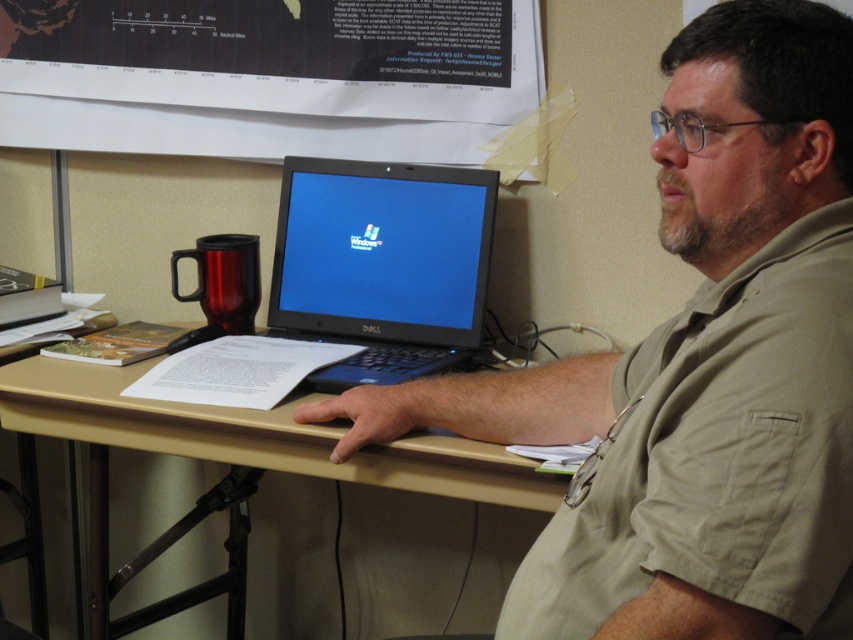
Question: Among these points, which one is farthest from the camera?

Choices:
 (A) (335, 163)
 (B) (225, 452)
 (C) (134, 132)

Answer: (C)

Question: Which object is positioned closest to the white paper at upper center?

Choices:
 (A) beige wood computer desk at center
 (B) black plastic laptop at center
 (C) matte black laptop at center

Answer: (B)

Question: Can you confirm if black plastic laptop at center is thinner than beige wood computer desk at center?

Choices:
 (A) no
 (B) yes

Answer: (B)

Question: Which object appears closest to the camera in this image?

Choices:
 (A) black plastic laptop at center
 (B) white paper at upper center
 (C) beige wood computer desk at center
 (D) matte black laptop at center

Answer: (D)

Question: Can you confirm if matte black laptop at center is positioned below black plastic laptop at center?

Choices:
 (A) no
 (B) yes

Answer: (B)

Question: Can you confirm if white paper at upper center is positioned below beige wood computer desk at center?

Choices:
 (A) no
 (B) yes

Answer: (A)